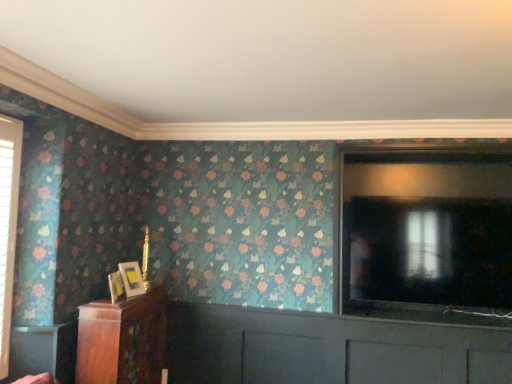
Where is `white matte ceiling at upper center`? white matte ceiling at upper center is located at coordinates (267, 66).

Describe the element at coordinates (116, 287) in the screenshot. The width and height of the screenshot is (512, 384). I see `matte gold picture frame at left, the 1th picture frame positioned from the front` at that location.

Measure the distance between wooden cabinet at lower left and camera.

wooden cabinet at lower left is 2.34 meters away from camera.

Where is `wooden cabinet at lower left`? Image resolution: width=512 pixels, height=384 pixels. wooden cabinet at lower left is located at coordinates (122, 340).

Find the location of `white matte ceiling at upper center`. white matte ceiling at upper center is located at coordinates (267, 66).

From the picture: Is wooden table at lower left oriented away from matte gold picture frame at left, the second picture frame positioned from the back?

No, wooden table at lower left is not facing away from matte gold picture frame at left, the second picture frame positioned from the back.

Locate an element on the screen. The image size is (512, 384). the 1st picture frame to the right of the wooden table at lower left, starting your count from the anchor is located at coordinates (116, 287).

Between wooden table at lower left and matte gold picture frame at left, the 1th picture frame positioned from the front, which one has smaller width?

Thinner between the two is wooden table at lower left.

Can you confirm if wooden table at lower left is smaller than matte gold picture frame at left, the second picture frame positioned from the back?

No.

Which is farther from the camera, (57, 327) or (144, 314)?

The point (144, 314) is farther from the camera.

Who is shorter, wooden table at lower left or wooden cabinet at lower left?

wooden table at lower left is shorter.

How distant is wooden table at lower left from wooden cabinet at lower left?

A distance of 11.55 inches exists between wooden table at lower left and wooden cabinet at lower left.

Consider the image. Based on their positions, is wooden table at lower left located to the left or right of wooden cabinet at lower left?

wooden table at lower left is to the left of wooden cabinet at lower left.

Is wooden cabinet at lower left a part of matte gold picture frame at lower left, acting as the 2th picture frame starting from the front?

No, wooden cabinet at lower left is not inside matte gold picture frame at lower left, acting as the 2th picture frame starting from the front.

Based on the photo, could you tell me if matte gold picture frame at lower left, the first picture frame viewed from the back, is turned towards wooden cabinet at lower left?

No, matte gold picture frame at lower left, the first picture frame viewed from the back, does not turn towards wooden cabinet at lower left.

Based on the photo, considering the relative positions of matte gold picture frame at lower left, the first picture frame viewed from the back, and wooden cabinet at lower left in the image provided, is matte gold picture frame at lower left, the first picture frame viewed from the back, behind wooden cabinet at lower left?

Yes.

Measure the distance between matte gold picture frame at lower left, acting as the 2th picture frame starting from the front, and wooden cabinet at lower left.

matte gold picture frame at lower left, acting as the 2th picture frame starting from the front, is 12.29 inches away from wooden cabinet at lower left.

How different are the orientations of white matte ceiling at upper center and matte gold picture frame at left, the second picture frame positioned from the back, in degrees?

white matte ceiling at upper center and matte gold picture frame at left, the second picture frame positioned from the back, are facing 78.2 degrees away from each other.

At what (x,y) coordinates should I click in order to perform the action: click on backdrop above the matte gold picture frame at left, the second picture frame positioned from the back (from the image's perspective). Please return your answer as a coordinate pair (x, y). The height and width of the screenshot is (384, 512). Looking at the image, I should click on (267, 66).

Does white matte ceiling at upper center appear on the left side of matte gold picture frame at left, the 1th picture frame positioned from the front?

No.

Considering the sizes of objects white matte ceiling at upper center and matte gold picture frame at left, the second picture frame positioned from the back, in the image provided, who is thinner, white matte ceiling at upper center or matte gold picture frame at left, the second picture frame positioned from the back,?

With smaller width is matte gold picture frame at left, the second picture frame positioned from the back.

Are matte gold picture frame at left, the second picture frame positioned from the back, and wooden cabinet at lower left making contact?

No, matte gold picture frame at left, the second picture frame positioned from the back, is not with wooden cabinet at lower left.

Considering the positions of points (123, 292) and (137, 346), is point (123, 292) farther from camera compared to point (137, 346)?

No.

Between matte gold picture frame at left, the second picture frame positioned from the back, and wooden cabinet at lower left, which one appears on the right side from the viewer's perspective?

Positioned to the right is wooden cabinet at lower left.

This screenshot has height=384, width=512. I want to click on furniture below the matte gold picture frame at left, the 1th picture frame positioned from the front (from a real-world perspective), so click(122, 340).

How many degrees apart are the facing directions of matte gold picture frame at left, the 1th picture frame positioned from the front, and white matte ceiling at upper center?

There is a 78.2-degree angle between the facing directions of matte gold picture frame at left, the 1th picture frame positioned from the front, and white matte ceiling at upper center.

Where is `backdrop positioned vertically above the matte gold picture frame at left, the 1th picture frame positioned from the front (from a real-world perspective)`? Image resolution: width=512 pixels, height=384 pixels. backdrop positioned vertically above the matte gold picture frame at left, the 1th picture frame positioned from the front (from a real-world perspective) is located at coordinates (267, 66).

Which is in front, matte gold picture frame at left, the 1th picture frame positioned from the front, or white matte ceiling at upper center?

white matte ceiling at upper center is closer to the camera.

From the image's perspective, between matte gold picture frame at left, the 1th picture frame positioned from the front, and white matte ceiling at upper center, who is located below?

From the image's view, matte gold picture frame at left, the 1th picture frame positioned from the front, is below.

Could you tell me if matte gold picture frame at left, the second picture frame positioned from the back, is facing matte gold picture frame at lower left, the first picture frame viewed from the back?

No, matte gold picture frame at left, the second picture frame positioned from the back, is not turned towards matte gold picture frame at lower left, the first picture frame viewed from the back.

Can you confirm if matte gold picture frame at left, the 1th picture frame positioned from the front, is bigger than matte gold picture frame at lower left, the first picture frame viewed from the back?

Incorrect, matte gold picture frame at left, the 1th picture frame positioned from the front, is not larger than matte gold picture frame at lower left, the first picture frame viewed from the back.

Is matte gold picture frame at left, the 1th picture frame positioned from the front, spatially inside matte gold picture frame at lower left, acting as the 2th picture frame starting from the front, or outside of it?

The correct answer is: outside.

Does matte gold picture frame at left, the second picture frame positioned from the back, appear on the left side of matte gold picture frame at lower left, acting as the 2th picture frame starting from the front?

Correct, you'll find matte gold picture frame at left, the second picture frame positioned from the back, to the left of matte gold picture frame at lower left, acting as the 2th picture frame starting from the front.

The image size is (512, 384). Identify the location of picture frame that is the 1st object above the wooden table at lower left (from a real-world perspective). (116, 287).

Locate an element on the screen. furniture behind the wooden table at lower left is located at coordinates (122, 340).

Based on the photo, based on their spatial positions, is wooden table at lower left or white matte ceiling at upper center closer to transparent glass screen door at right?

white matte ceiling at upper center is positioned closer to the anchor transparent glass screen door at right.

Considering their positions, is transparent glass screen door at right positioned further to wooden cabinet at lower left than matte gold picture frame at left, the 1th picture frame positioned from the front?

transparent glass screen door at right lies further to wooden cabinet at lower left than the other object.

From the picture: Looking at the image, which one is located further to wooden table at lower left, wooden cabinet at lower left or matte gold picture frame at lower left, acting as the 2th picture frame starting from the front?

matte gold picture frame at lower left, acting as the 2th picture frame starting from the front.

Considering their positions, is matte gold picture frame at lower left, the first picture frame viewed from the back, positioned closer to matte gold picture frame at left, the 1th picture frame positioned from the front, than transparent glass screen door at right?

matte gold picture frame at lower left, the first picture frame viewed from the back, lies closer to matte gold picture frame at left, the 1th picture frame positioned from the front, than the other object.

From the image, which object appears to be farther from matte gold picture frame at lower left, the first picture frame viewed from the back, wooden cabinet at lower left or wooden table at lower left?

Among the two, wooden table at lower left is located further to matte gold picture frame at lower left, the first picture frame viewed from the back.

Consider the image. Which object lies further to the anchor point wooden cabinet at lower left, matte gold picture frame at left, the second picture frame positioned from the back, or wooden table at lower left?

The object further to wooden cabinet at lower left is matte gold picture frame at left, the second picture frame positioned from the back.

Considering their positions, is wooden cabinet at lower left positioned closer to transparent glass screen door at right than matte gold picture frame at left, the second picture frame positioned from the back?

Among the two, wooden cabinet at lower left is located nearer to transparent glass screen door at right.

When comparing their distances from wooden cabinet at lower left, does white matte ceiling at upper center or transparent glass screen door at right seem further?

transparent glass screen door at right lies further to wooden cabinet at lower left than the other object.

Image resolution: width=512 pixels, height=384 pixels. Identify the location of table between matte gold picture frame at left, the second picture frame positioned from the back, and wooden cabinet at lower left vertically. (42, 351).

Find the location of a particular element. The height and width of the screenshot is (384, 512). picture frame situated between matte gold picture frame at left, the second picture frame positioned from the back, and transparent glass screen door at right from left to right is located at coordinates (132, 278).

The height and width of the screenshot is (384, 512). Identify the location of picture frame between wooden table at lower left and matte gold picture frame at lower left, acting as the 2th picture frame starting from the front, from left to right. (116, 287).

Identify the location of backdrop located between wooden cabinet at lower left and transparent glass screen door at right in the left-right direction. Image resolution: width=512 pixels, height=384 pixels. (267, 66).